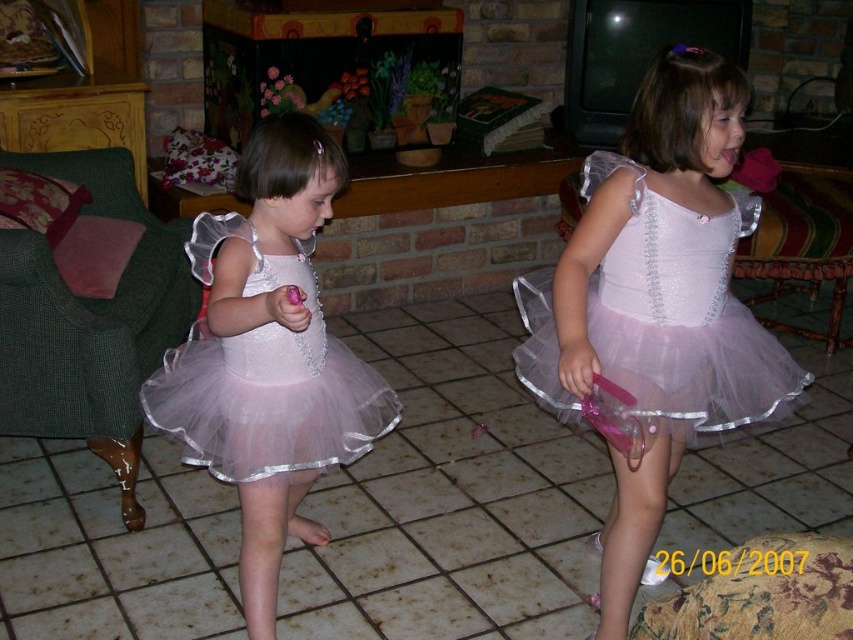
Based on the photo, is pink tulle dress at center below pink tulle ballet skirt at center?

Yes.

Between pink tulle dress at center and pink tulle ballet skirt at center, which one appears on the left side from the viewer's perspective?

Positioned to the left is pink tulle ballet skirt at center.

Describe the element at coordinates (654, 308) in the screenshot. This screenshot has width=853, height=640. I see `pink tulle dress at center` at that location.

Image resolution: width=853 pixels, height=640 pixels. I want to click on pink tulle dress at center, so click(654, 308).

What do you see at coordinates (265, 378) in the screenshot?
I see `pink tulle dress at left` at bounding box center [265, 378].

Image resolution: width=853 pixels, height=640 pixels. In order to click on pink tulle dress at left in this screenshot , I will do coord(265,378).

Image resolution: width=853 pixels, height=640 pixels. Identify the location of pink tulle dress at left. (265, 378).

Can you confirm if pink tulle dress at center is smaller than pink tulle dress at left?

No.

Is pink tulle dress at center bigger than pink tulle dress at left?

Correct, pink tulle dress at center is larger in size than pink tulle dress at left.

Which is in front, point (679, 68) or point (171, 360)?

Point (679, 68)

At what (x,y) coordinates should I click in order to perform the action: click on pink tulle dress at center. Please return your answer as a coordinate pair (x, y). Image resolution: width=853 pixels, height=640 pixels. Looking at the image, I should click on (654, 308).